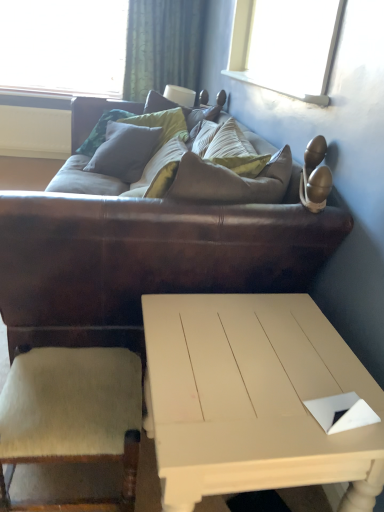
Question: Is brown leather couch at center inside the boundaries of matte gray pillow at center, or outside?

Choices:
 (A) outside
 (B) inside

Answer: (A)

Question: Considering the positions of brown leather couch at center and matte gray pillow at center in the image, is brown leather couch at center bigger or smaller than matte gray pillow at center?

Choices:
 (A) big
 (B) small

Answer: (A)

Question: Which is nearer to the green textured curtain at upper center?

Choices:
 (A) beige wool armchair at lower left
 (B) matte gray pillow at center
 (C) white painted wood coffee table at lower center
 (D) brown leather couch at center

Answer: (B)

Question: Which of these objects is positioned closest to the beige wool armchair at lower left?

Choices:
 (A) green textured curtain at upper center
 (B) white painted wood coffee table at lower center
 (C) matte gray pillow at center
 (D) brown leather couch at center

Answer: (B)